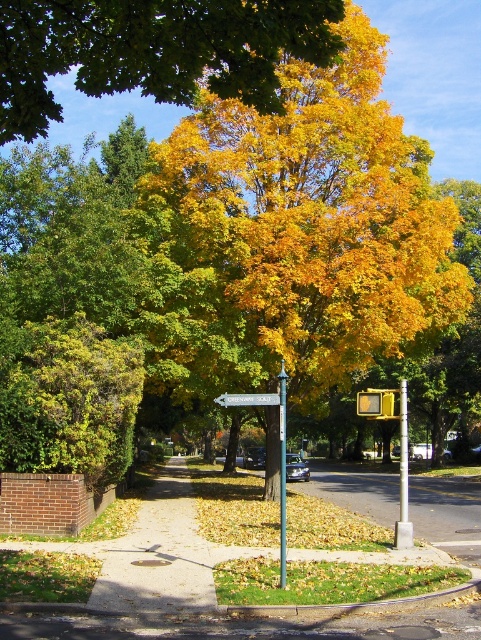
Question: Which object appears closest to the camera in this image?

Choices:
 (A) white plastic signpost at center
 (B) golden yellow leaves at upper center
 (C) metallic gray pole at center-right

Answer: (B)

Question: Which object is the closest to the metallic gray pole at center-right?

Choices:
 (A) white plastic signpost at center
 (B) metallic pole at center
 (C) golden yellow leaves at upper center

Answer: (B)

Question: Can you confirm if golden yellow leaves at upper center is thinner than metallic pole at center?

Choices:
 (A) yes
 (B) no

Answer: (B)

Question: Which object is closer to the camera taking this photo?

Choices:
 (A) metallic gray pole at center-right
 (B) metallic pole at center
 (C) white plastic signpost at center

Answer: (B)

Question: Does metallic pole at center have a larger size compared to white plastic signpost at center?

Choices:
 (A) yes
 (B) no

Answer: (A)

Question: Is golden yellow leaves at upper center further to the viewer compared to metallic gray pole at center-right?

Choices:
 (A) no
 (B) yes

Answer: (A)